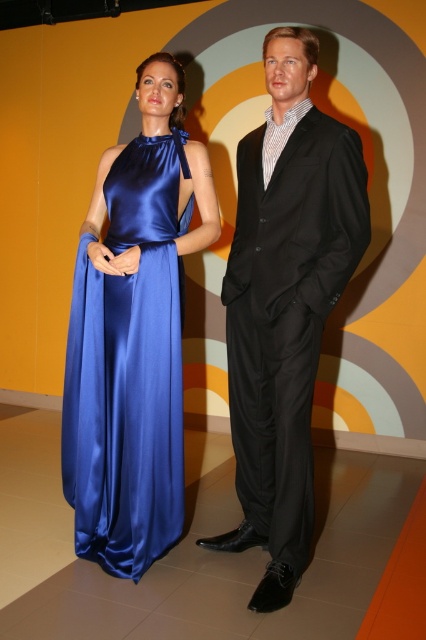
You are a photographer setting up for a photoshoot with the two figures. You need to ensure the black satin suit at center and the satin blue dress at left are both in focus. Given that your camera can only focus on objects within a 1.2 meter depth range, can both figures be in focus simultaneously?

The black satin suit at center is closer to the viewer than the satin blue dress at left. Since the camera can focus on objects within a 1.2 meter depth range, if the distance between them is within this range, both can be in focus. However, the exact answer depends on their actual separation distance, which isn

You are a photographer setting up a shoot with two models. One is wearing a blue satin gown and the other a black suit. You need to place a prop at point (285, 304). The prop must be placed exactly where the black satin suit is located. Which model should you ask to move so the prop can be placed correctly?

The prop must be placed where the black satin suit at center is located, so the model wearing the black satin suit should move to allow placement of the prop at that exact point.

You are a photographer adjusting the focus of your camera. You have two points in the scene that need to be in focus. The first point is at coordinates point (288, 260) and the second is at point (89, 282). Since you can only focus on one depth at a time, which point should you prioritize to ensure it is in focus first?

Point (288, 260) is closer to the camera than point (89, 282), so you should prioritize focusing on point (288, 260) first to ensure it is in focus.